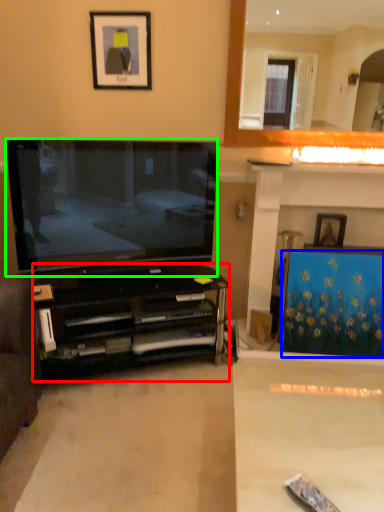
Question: Which is nearer to the cabinetry (highlighted by a red box)? curtain (highlighted by a blue box) or television (highlighted by a green box).

Choices:
 (A) curtain
 (B) television

Answer: (B)